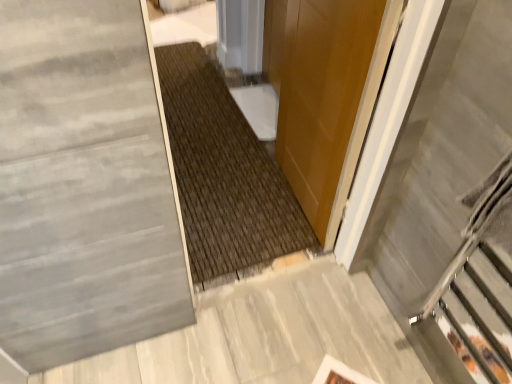
Question: From the image's perspective, is glossy wood door at center over gray polished concrete at lower left?

Choices:
 (A) yes
 (B) no

Answer: (A)

Question: Could you tell me if glossy wood door at center is turned towards gray polished concrete at lower left?

Choices:
 (A) yes
 (B) no

Answer: (B)

Question: Is glossy wood door at center closer to the viewer compared to gray polished concrete at lower left?

Choices:
 (A) yes
 (B) no

Answer: (A)

Question: Considering the relative positions of glossy wood door at center and gray polished concrete at lower left in the image provided, is glossy wood door at center to the right of gray polished concrete at lower left from the viewer's perspective?

Choices:
 (A) yes
 (B) no

Answer: (A)

Question: Is glossy wood door at center far from gray polished concrete at lower left?

Choices:
 (A) no
 (B) yes

Answer: (A)

Question: Can you confirm if glossy wood door at center is shorter than gray polished concrete at lower left?

Choices:
 (A) no
 (B) yes

Answer: (A)

Question: Is gray polished concrete at lower left aimed at glossy wood door at center?

Choices:
 (A) no
 (B) yes

Answer: (A)

Question: Is gray polished concrete at lower left thinner than glossy wood door at center?

Choices:
 (A) yes
 (B) no

Answer: (B)

Question: Can glossy wood door at center be found inside gray polished concrete at lower left?

Choices:
 (A) yes
 (B) no

Answer: (B)

Question: Considering the relative sizes of gray polished concrete at lower left and glossy wood door at center in the image provided, is gray polished concrete at lower left shorter than glossy wood door at center?

Choices:
 (A) yes
 (B) no

Answer: (A)

Question: Is gray polished concrete at lower left closer to camera compared to glossy wood door at center?

Choices:
 (A) no
 (B) yes

Answer: (A)

Question: Is gray polished concrete at lower left bigger than glossy wood door at center?

Choices:
 (A) no
 (B) yes

Answer: (A)

Question: From a real-world perspective, is gray polished concrete at lower left below metallic gray escalator at right?

Choices:
 (A) no
 (B) yes

Answer: (B)